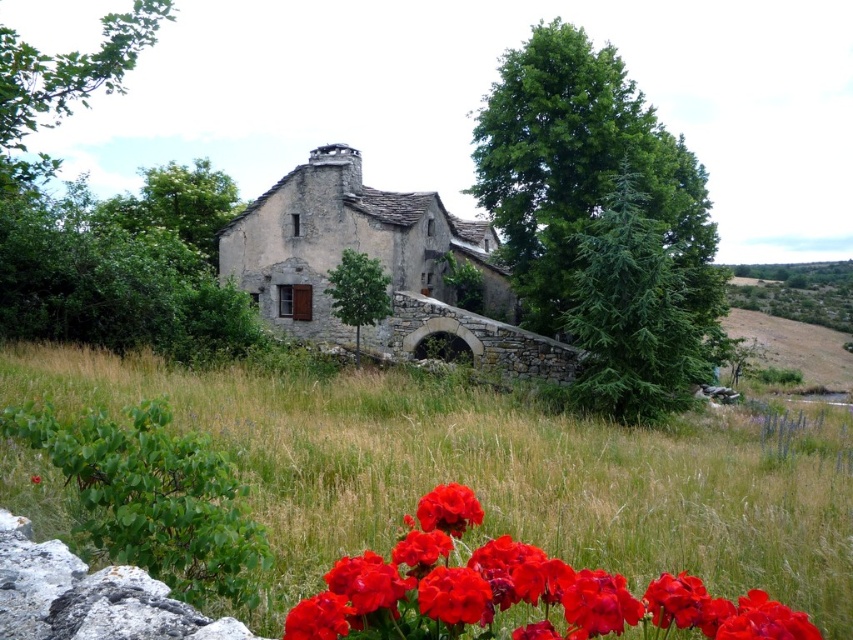
Looking at this image, you are a gardener who wants to plant new flowers in the garden. You notice the green grass at center and the glossy red flowers at lower center. Which area would be better for planting new flowers if you want them to grow taller than the existing flowers?

The green grass at center has a greater height compared to the glossy red flowers at lower center, so planting new flowers in the green grass at center area would allow them to grow taller than the existing flowers.

Looking at this image, you are standing in front of the rustic stone house and want to place a small decorative statue exactly at the point marked by the coordinates point [517,596]. However, there are already glossy red flowers at lower center located there. What should you do to avoid placing the statue on top of the flowers?

The point [517,596] is where the glossy red flowers at lower center are located. To avoid placing the statue on them, you should choose a different location that does not overlap with the glossy red flowers at lower center.